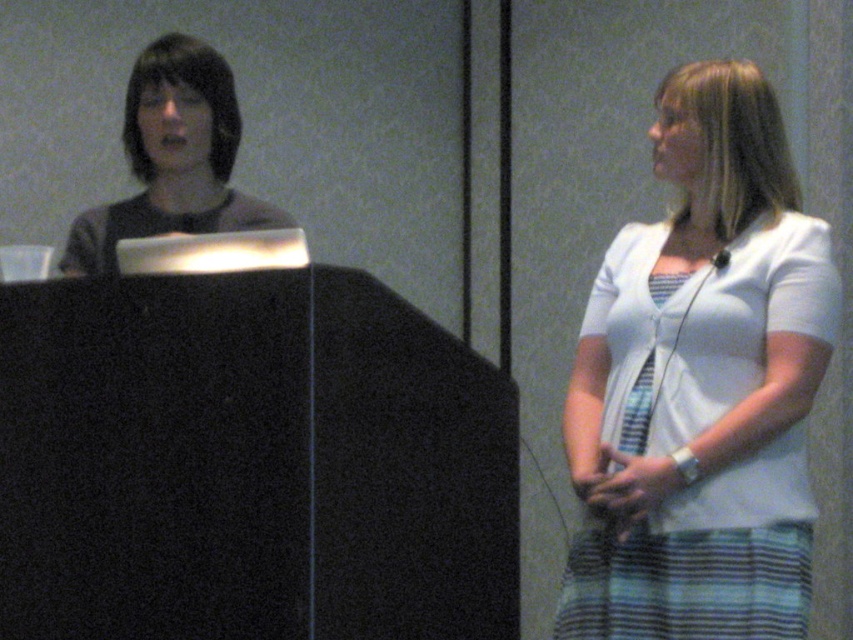
Based on the photo, you are attending a meeting and need to hand a document to the person wearing the white textured blouse at center. Which direction should you walk from the matte black shirt at left to reach them?

The white textured blouse at center is to the right of the matte black shirt at left, so you should walk to the right from the matte black shirt at left to reach them.

You are organizing a photoshoot and need to know the clothing details of the two people in the image. Which clothing item is narrower in width between the white textured blouse at center and the matte black shirt at left?

The white textured blouse at center is narrower in width than the matte black shirt at left according to the description.